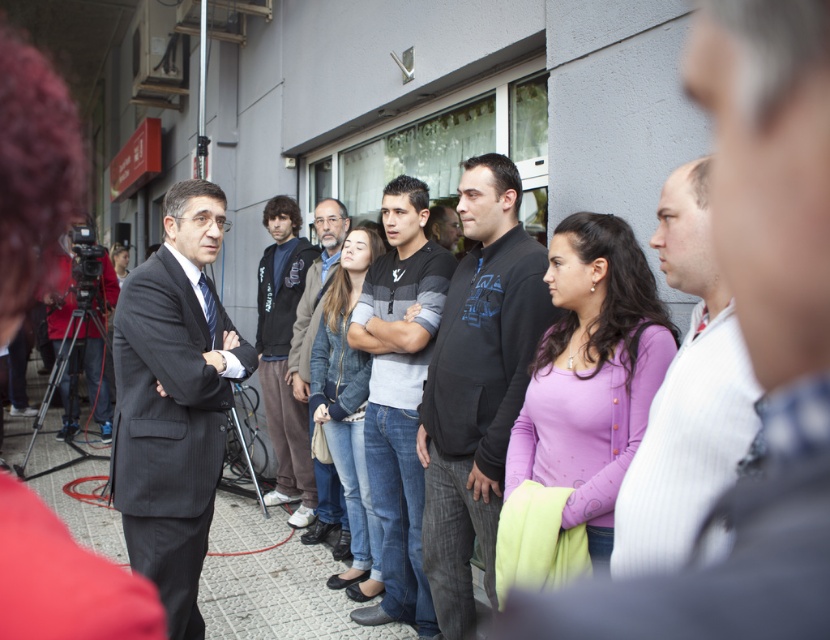
You are standing at the origin point of the coordinate system in the image. The dark gray sweater at center is located at point (477, 385). If you want to move towards the dark gray sweater at center, which direction should you move in terms of the coordinate system?

To move towards the dark gray sweater at center located at point (477, 385) from the origin, you should move in the positive x and positive y direction since both coordinates are greater than zero.